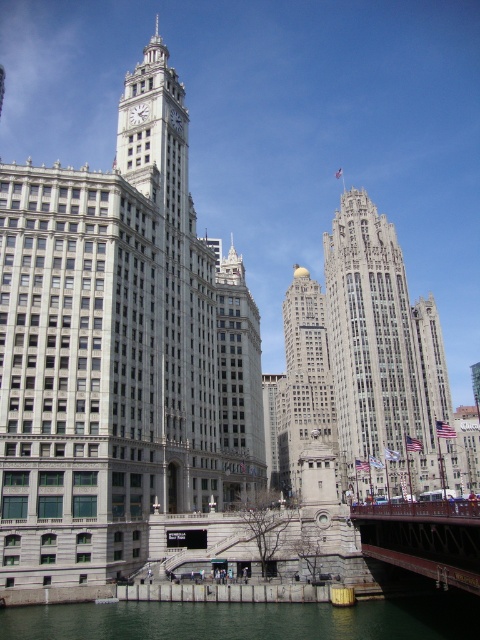
Question: Which object is positioned farthest from the greenish water at lower center?

Choices:
 (A) gold polished dome at center
 (B) metallic red bridge at lower right
 (C) silver metallic skyscraper at center
 (D) gray stone skyscraper at center

Answer: (D)

Question: Does greenish water at lower center have a larger size compared to white stone clock tower at center?

Choices:
 (A) yes
 (B) no

Answer: (B)

Question: Which object is closer to the camera taking this photo?

Choices:
 (A) silver metallic skyscraper at center
 (B) white stone clock tower at center

Answer: (B)

Question: Which object appears closest to the camera in this image?

Choices:
 (A) matte white clock at center
 (B) white stone clock tower at left

Answer: (B)

Question: Considering the relative positions of greenish water at lower center and silver metallic skyscraper at center in the image provided, where is greenish water at lower center located with respect to silver metallic skyscraper at center?

Choices:
 (A) right
 (B) left

Answer: (A)

Question: Can you confirm if greenish water at lower center is smaller than white stone clock tower at center?

Choices:
 (A) no
 (B) yes

Answer: (B)